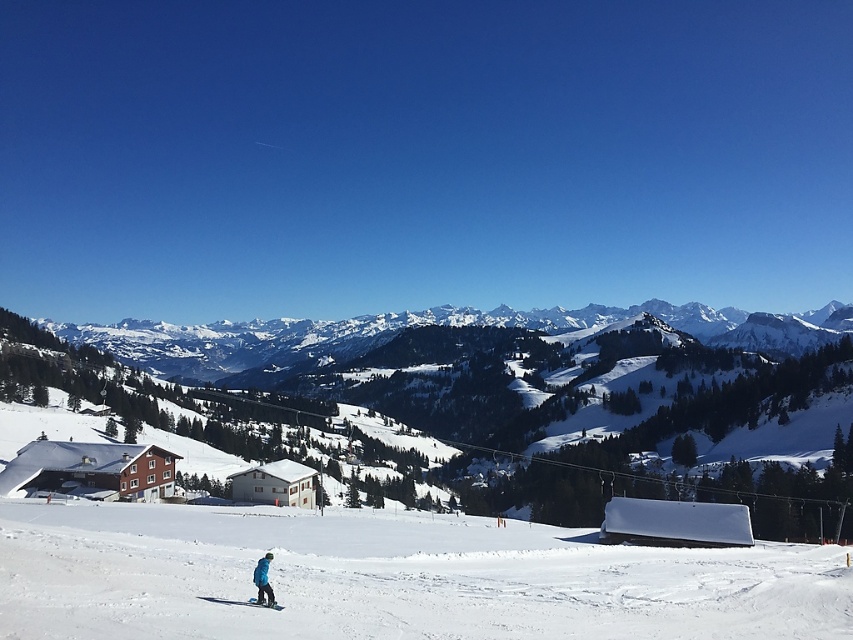
Does blue fabric snowsuit at lower center appear over matte blue ski at lower center?

Yes.

Is blue fabric snowsuit at lower center wider than matte blue ski at lower center?

Yes, blue fabric snowsuit at lower center is wider than matte blue ski at lower center.

Is point (259, 596) positioned after point (276, 602)?

That is True.

The width and height of the screenshot is (853, 640). Identify the location of blue fabric snowsuit at lower center. (263, 580).

Is the position of white powdery snow at center more distant than that of blue fabric snowsuit at lower center?

No, it is not.

This screenshot has height=640, width=853. Find the location of `white powdery snow at center`. white powdery snow at center is located at coordinates (393, 579).

Which is in front, point (142, 589) or point (265, 588)?

Positioned in front is point (142, 589).

Find the location of a particular element. white powdery snow at center is located at coordinates (393, 579).

Is white powdery snow at center wider than matte blue ski at lower center?

Correct, the width of white powdery snow at center exceeds that of matte blue ski at lower center.

Describe the element at coordinates (393, 579) in the screenshot. I see `white powdery snow at center` at that location.

Which is behind, point (383, 561) or point (271, 605)?

Positioned behind is point (383, 561).

You are a GUI agent. You are given a task and a screenshot of the screen. Output one action in this format:
    pyautogui.click(x=<x>, y=<y>)
    Task: Click on the white powdery snow at center
    
    Given the screenshot: What is the action you would take?
    pyautogui.click(x=393, y=579)